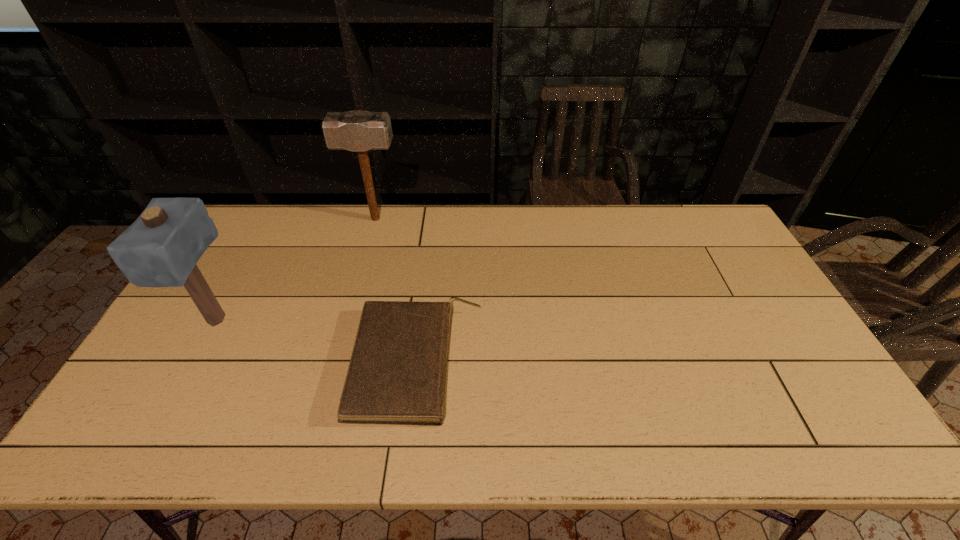
In order to click on the farther mallet in this screenshot , I will do `click(358, 130)`.

Identify the location of the right mallet. (358, 130).

Locate an element on the screen. Image resolution: width=960 pixels, height=540 pixels. the nearer mallet is located at coordinates (161, 248).

I want to click on the leftmost object, so click(161, 248).

This screenshot has height=540, width=960. Find the location of `the shortest object`. the shortest object is located at coordinates (397, 372).

This screenshot has height=540, width=960. Identify the location of vacant space located 0.230m on the striking face of the farthest object. (466, 219).

Find the location of a particular element. Image resolution: width=960 pixels, height=540 pixels. vacant position located 0.220m on the back of the leftmost object is located at coordinates (257, 248).

The width and height of the screenshot is (960, 540). Find the location of `vacant region located 0.330m on the spine side of the paperback book`. vacant region located 0.330m on the spine side of the paperback book is located at coordinates (606, 362).

What are the coordinates of `object that is at the far edge` in the screenshot? It's located at (358, 130).

Where is `object located at the near edge`? object located at the near edge is located at coordinates (397, 372).